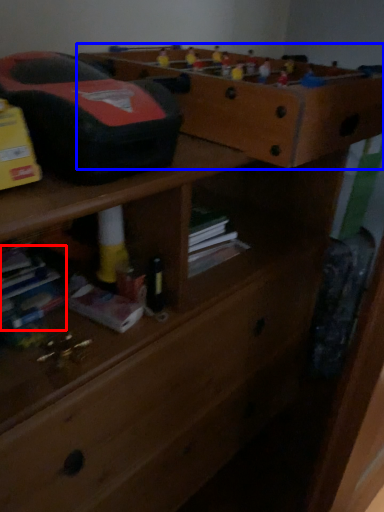
Question: Which object appears closest to the camera in this image, book (highlighted by a red box) or shelf (highlighted by a blue box)?

Choices:
 (A) book
 (B) shelf

Answer: (B)